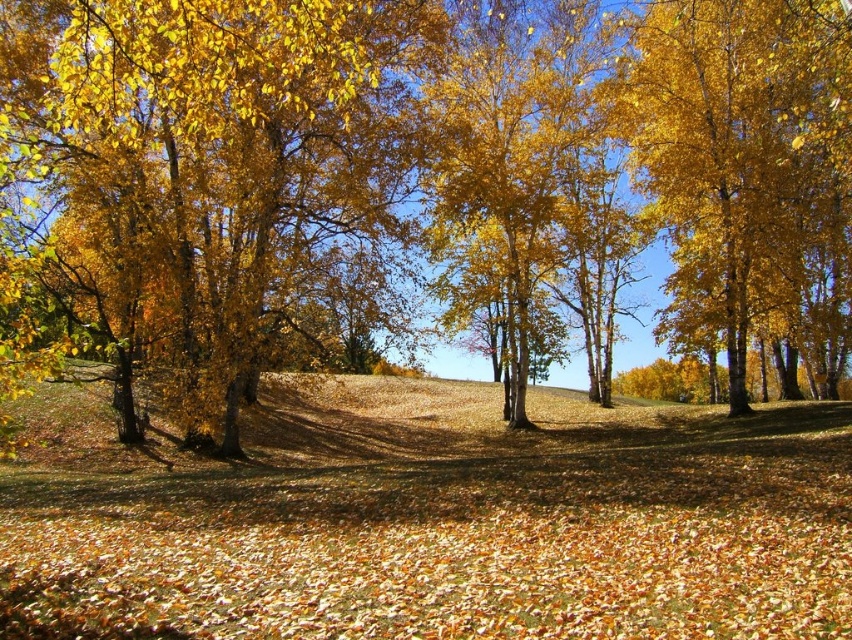
Is golden textured tree at left shorter than golden smooth tree at right?

Indeed, golden textured tree at left has a lesser height compared to golden smooth tree at right.

Between point (62, 257) and point (781, 164), which one is positioned behind?

Point (781, 164)

Is point (396, 49) less distant than point (684, 36)?

Yes, it is.

You are a GUI agent. You are given a task and a screenshot of the screen. Output one action in this format:
    pyautogui.click(x=<x>, y=<y>)
    Task: Click on the golden textured tree at left
    
    Given the screenshot: What is the action you would take?
    pyautogui.click(x=205, y=179)